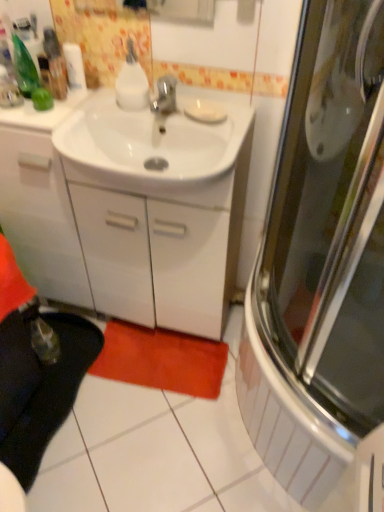
Question: Considering the relative sizes of black fabric carpet at lower left and white glossy cabinet at center in the image provided, is black fabric carpet at lower left bigger than white glossy cabinet at center?

Choices:
 (A) no
 (B) yes

Answer: (A)

Question: Is black fabric carpet at lower left facing towards white glossy cabinet at center?

Choices:
 (A) no
 (B) yes

Answer: (A)

Question: Considering the relative positions of black fabric carpet at lower left and white glossy cabinet at center in the image provided, is black fabric carpet at lower left to the left of white glossy cabinet at center from the viewer's perspective?

Choices:
 (A) yes
 (B) no

Answer: (A)

Question: Is black fabric carpet at lower left outside white glossy cabinet at center?

Choices:
 (A) no
 (B) yes

Answer: (B)

Question: Considering the relative sizes of black fabric carpet at lower left and white glossy cabinet at center in the image provided, is black fabric carpet at lower left wider than white glossy cabinet at center?

Choices:
 (A) yes
 (B) no

Answer: (A)

Question: Does black fabric carpet at lower left lie behind white glossy cabinet at center?

Choices:
 (A) yes
 (B) no

Answer: (A)

Question: Is white glossy sink at center to the right of white matte toilet paper at upper left from the viewer's perspective?

Choices:
 (A) yes
 (B) no

Answer: (A)

Question: Is white glossy sink at center at the left side of white matte toilet paper at upper left?

Choices:
 (A) no
 (B) yes

Answer: (A)

Question: From a real-world perspective, is white glossy sink at center located beneath white matte toilet paper at upper left?

Choices:
 (A) yes
 (B) no

Answer: (A)

Question: Is white glossy sink at center oriented away from white matte toilet paper at upper left?

Choices:
 (A) no
 (B) yes

Answer: (A)

Question: Is white glossy sink at center taller than white matte toilet paper at upper left?

Choices:
 (A) yes
 (B) no

Answer: (A)

Question: Is white glossy sink at center beside white matte toilet paper at upper left?

Choices:
 (A) no
 (B) yes

Answer: (A)

Question: From the image's perspective, does white glossy cabinet at center appear higher than white matte toilet paper at upper left?

Choices:
 (A) no
 (B) yes

Answer: (A)